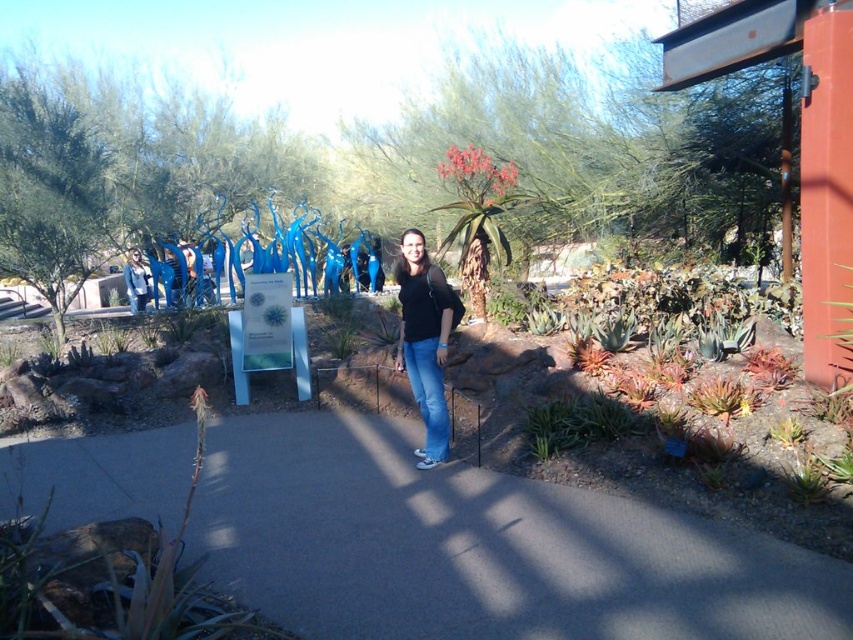
Which is behind, point (427, 435) or point (143, 308)?

The point (143, 308) is more distant.

What do you see at coordinates (428, 396) in the screenshot?
I see `blue denim jeans at center` at bounding box center [428, 396].

Where is `blue denim jeans at center`? The width and height of the screenshot is (853, 640). blue denim jeans at center is located at coordinates (428, 396).

Consider the image. Who is more distant from viewer, (273, 448) or (399, 241)?

Positioned behind is point (399, 241).

Does gray concrete path at center have a lesser width compared to black matte shirt at center?

No, gray concrete path at center is not thinner than black matte shirt at center.

Measure the distance between point [132,470] and camera.

Point [132,470] and camera are 5.31 meters apart.

Image resolution: width=853 pixels, height=640 pixels. Find the location of `gray concrete path at center`. gray concrete path at center is located at coordinates (479, 547).

Can you confirm if black matte shirt at center is taller than matte black jacket at center?

Yes.

Between black matte shirt at center and matte black jacket at center, which one is positioned higher?

matte black jacket at center is above.

In order to click on black matte shirt at center in this screenshot , I will do `click(425, 340)`.

Find the location of a particular element. The width and height of the screenshot is (853, 640). black matte shirt at center is located at coordinates (425, 340).